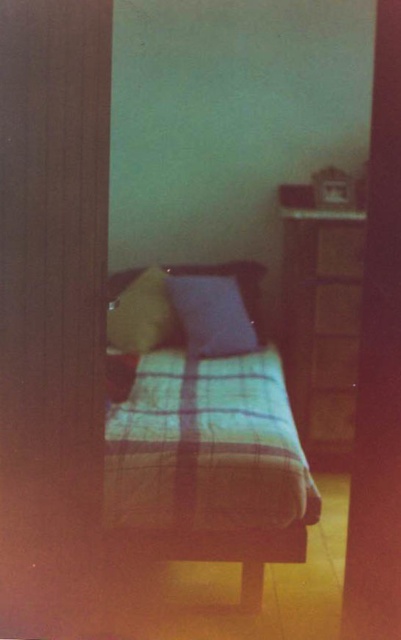
You are organizing your room and want to move the matte blue pillow at center to the wooden dresser at right. Based on their positions, will you need to lift the pillow over any objects to place it on the dresser?

The wooden dresser at right is located below the matte blue pillow at center, so you will need to lift the pillow over any objects between them. However, since the description does not mention other objects in the way, you can move the pillow directly to the dresser.

You are standing in a hallway and looking through the ajar door into the bedroom. You see two points marked in the room. Which point is closer to you, the one at coordinates point (303,413) or point (117,296)?

Point (117,296) is closer to you because point (303,413) is behind it.

You are a delivery person holding a package that is 1.5 meters long. You need to place it in the bedroom shown. Can you fit the package horizontally between the wooden dresser at right and the bed without moving any furniture?

The distance between the wooden dresser at right and the viewer is 1.54 meters. Since the package is 1.5 meters long, it should fit horizontally between them with a small amount of space remaining.